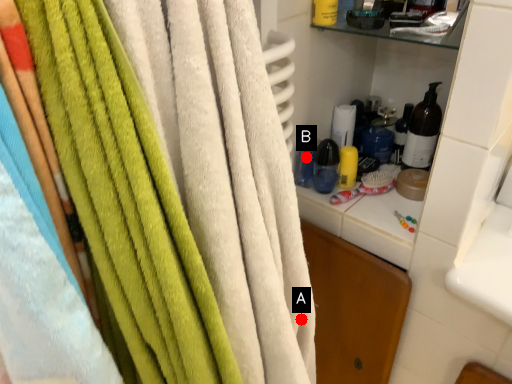
Question: Two points are circled on the image, labeled by A and B beside each circle. Which point appears closest to the camera in this image?

Choices:
 (A) A is closer
 (B) B is closer

Answer: (A)